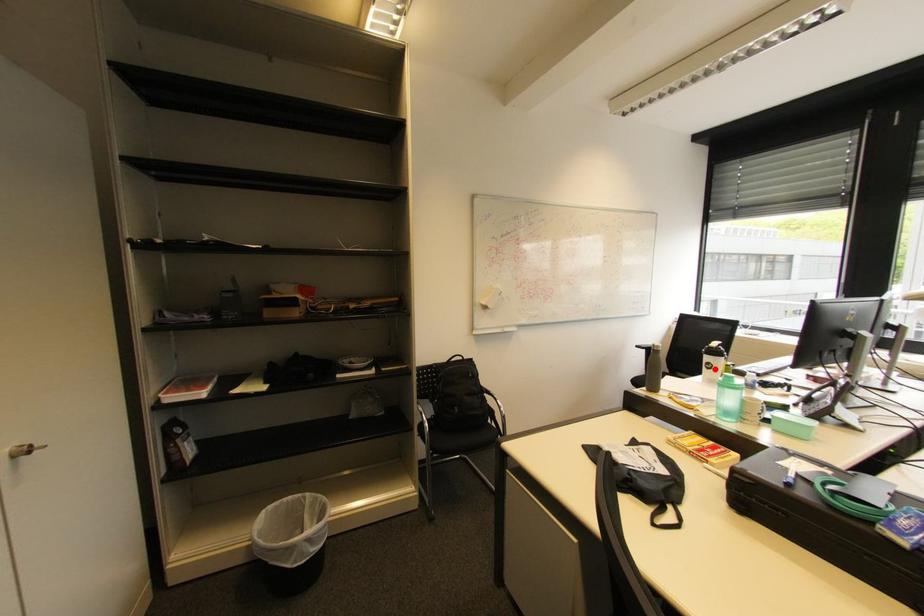
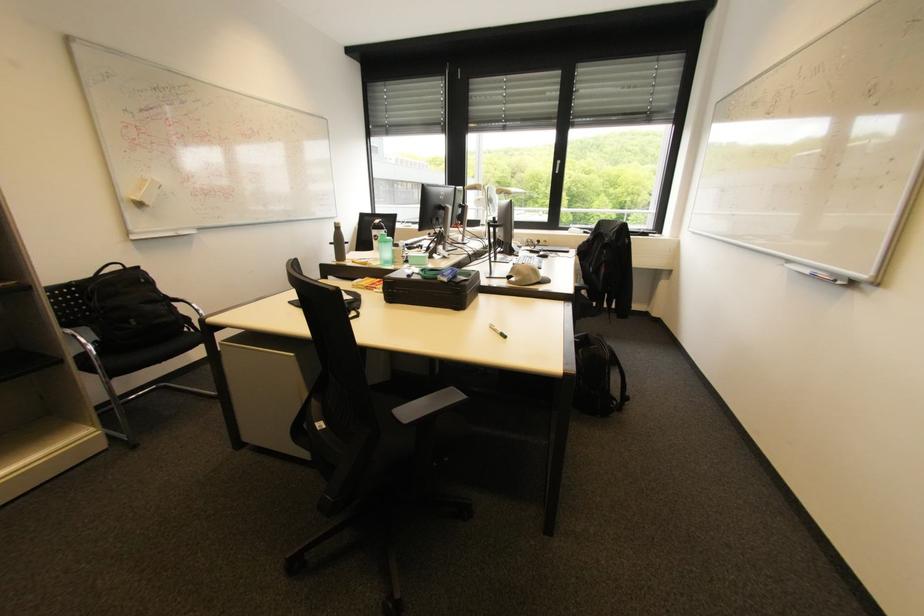
The point at the highlighted location is marked in the first image. Where is the corresponding point in the second image?

(382, 240)